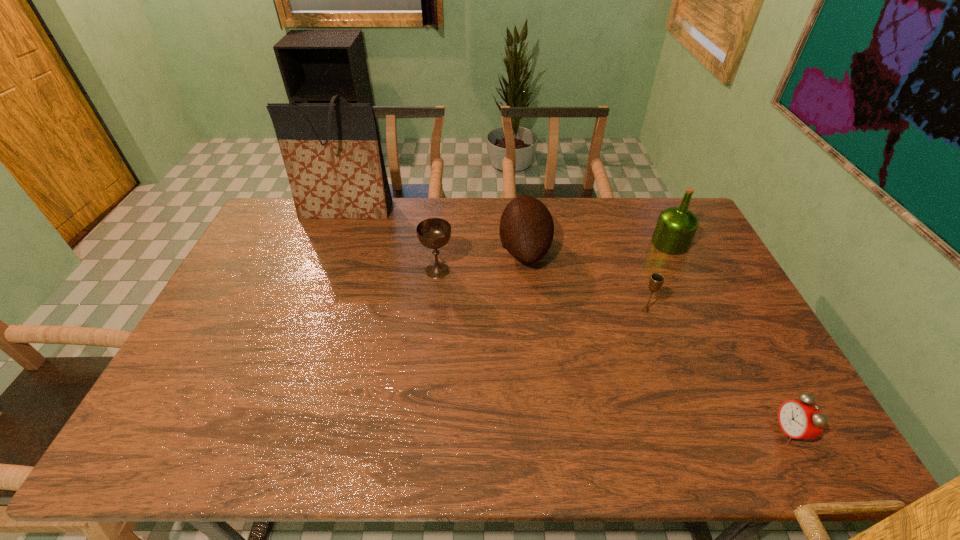
The height and width of the screenshot is (540, 960). Find the location of `free space that satisfies the following two spatial constraints: 1. on the laces of the shorter chalice; 2. on the right side of the third object from left to right`. free space that satisfies the following two spatial constraints: 1. on the laces of the shorter chalice; 2. on the right side of the third object from left to right is located at coordinates (532, 310).

Where is `vacant space that satisfies the following two spatial constraints: 1. on the front-facing side of the shopping bag; 2. on the left side of the right chalice`? vacant space that satisfies the following two spatial constraints: 1. on the front-facing side of the shopping bag; 2. on the left side of the right chalice is located at coordinates (309, 310).

Locate an element on the screen. The image size is (960, 540). free spot that satisfies the following two spatial constraints: 1. on the front side of the fifth shortest object; 2. on the laces of the football is located at coordinates (673, 249).